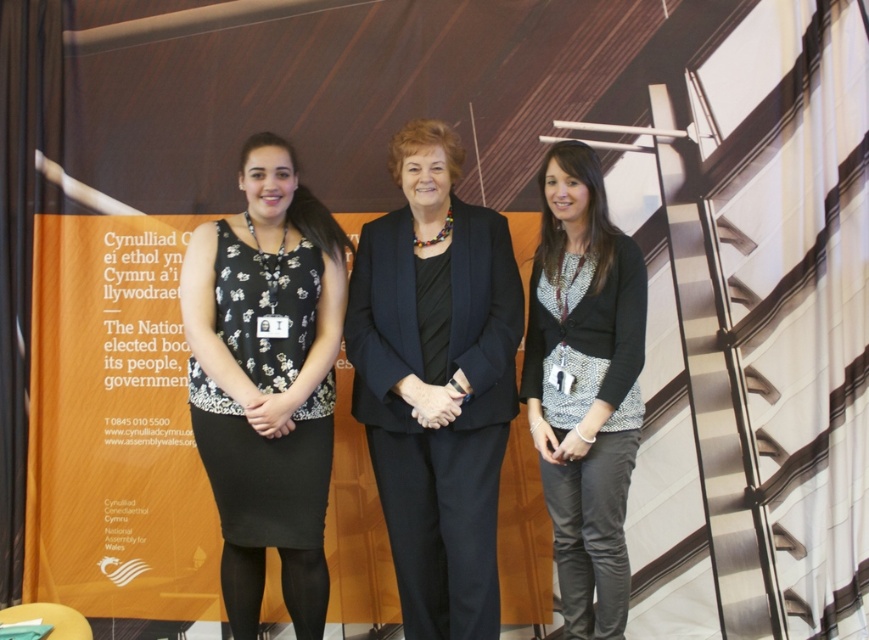
Is point (436, 616) positioned before point (276, 541)?

That is False.

Is black fabric suit at center above black matte dress at left?

Yes, black fabric suit at center is above black matte dress at left.

At what (x,y) coordinates should I click in order to perform the action: click on black fabric suit at center. Please return your answer as a coordinate pair (x, y). This screenshot has width=869, height=640. Looking at the image, I should click on (436, 381).

Is the position of black fabric suit at center more distant than that of patterned fabric cardigan at center?

Yes.

Which is in front, point (433, 513) or point (619, 445)?

Point (619, 445)

Identify the location of black fabric suit at center. The image size is (869, 640). tap(436, 381).

Can you confirm if black matte dress at left is positioned to the left of patterned fabric cardigan at center?

Correct, you'll find black matte dress at left to the left of patterned fabric cardigan at center.

Can you confirm if black matte dress at left is wider than patterned fabric cardigan at center?

Yes.

Between point (191, 403) and point (625, 433), which one is positioned behind?

Point (191, 403)

Where is `black matte dress at left`? black matte dress at left is located at coordinates (267, 380).